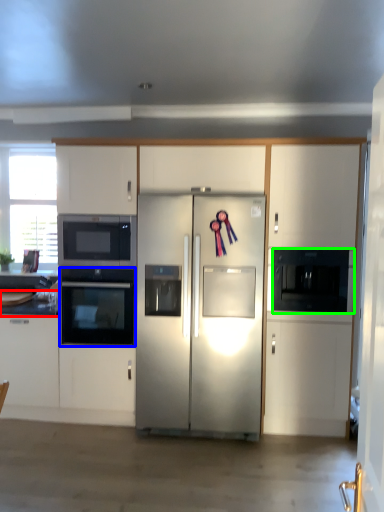
Question: Considering the real-world distances, which object is farthest from countertop (highlighted by a red box)? oven (highlighted by a blue box) or microwave oven (highlighted by a green box)?

Choices:
 (A) oven
 (B) microwave oven

Answer: (B)